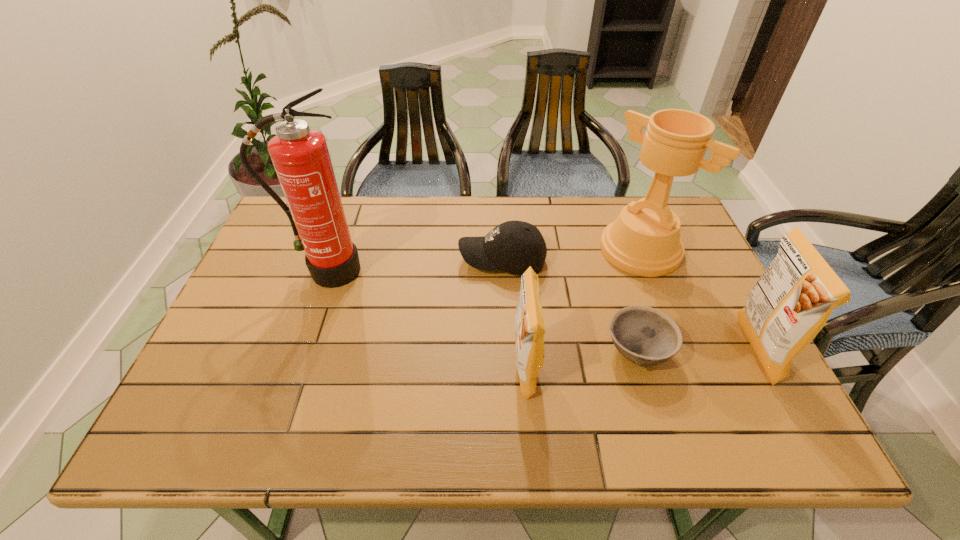
The image size is (960, 540). In order to click on vacant point that satisfies the following two spatial constraints: 1. on the front-facing side of the shortest object; 2. on the right side of the tallest object in this screenshot , I will do `click(300, 351)`.